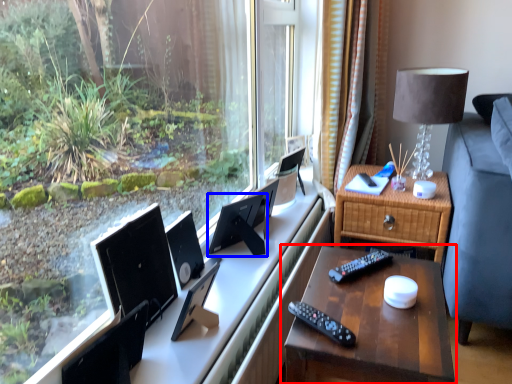
Question: Which object is closer to the camera taking this photo, nightstand (highlighted by a red box) or computer monitor (highlighted by a blue box)?

Choices:
 (A) nightstand
 (B) computer monitor

Answer: (A)